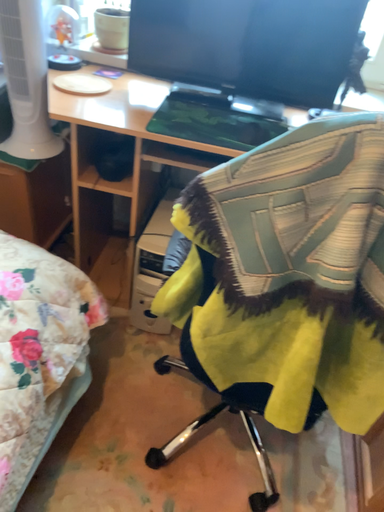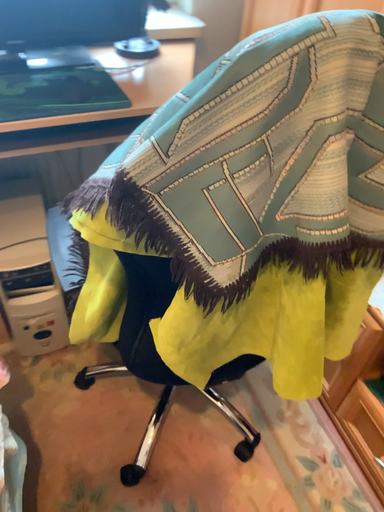
Question: Which way did the camera rotate in the video?

Choices:
 (A) rotated right
 (B) rotated left

Answer: (A)